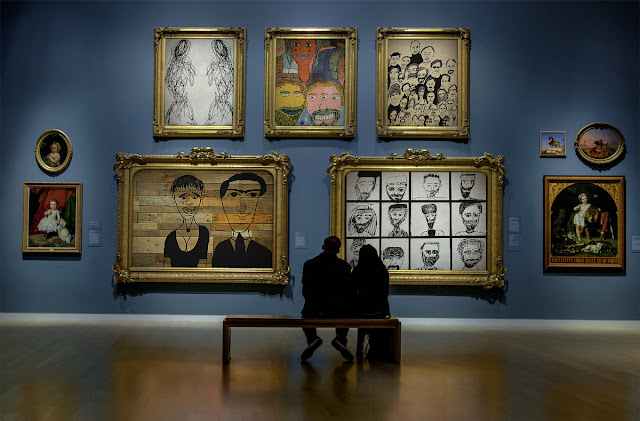
Where is `picture frame`? The height and width of the screenshot is (421, 640). picture frame is located at coordinates (52, 168), (77, 195), (129, 165), (157, 131), (267, 127), (385, 127), (342, 163), (546, 180), (541, 156), (595, 163).